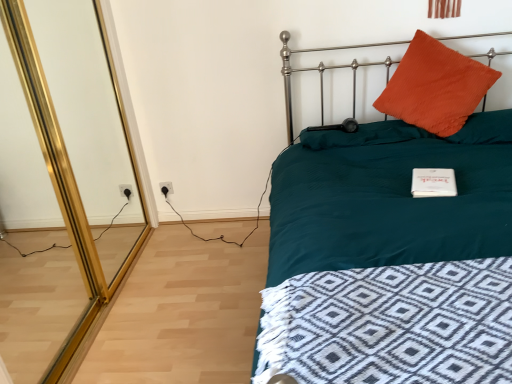
Identify the location of vacant space underneath gold mirrored screen door at left (from a real-world perspective). (95, 311).